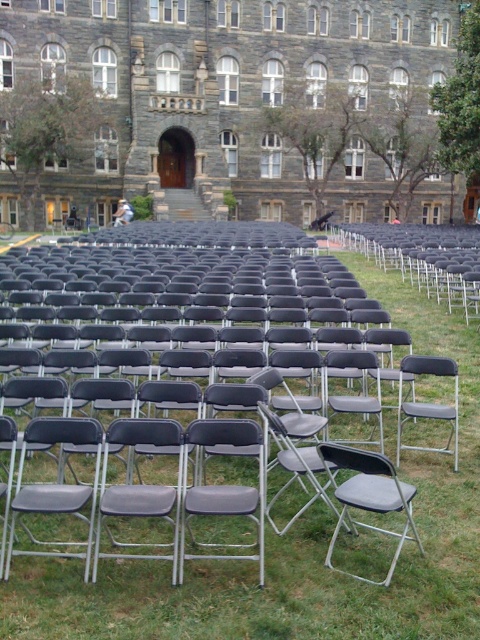
You are attending an outdoor event and need to find a spot where the green grass at center and the gray fabric folding chair at center are positioned such that the grass is to the right of the chair. Can you locate this arrangement?

Yes, the green grass at center is positioned to the right of the gray fabric folding chair at center, so this arrangement is possible.

Looking at this image, you are planning to set up a small picnic blanket in the area between the green grass at center and the gray fabric folding chair at center. Based on the scene description, which object will be visible above the other once the picnic blanket is placed?

The green grass at center is taller than the gray fabric folding chair at center, so the green grass at center will still be visible above the picnic blanket, while the gray fabric folding chair at center will be partially or fully hidden depending on the blanket size.